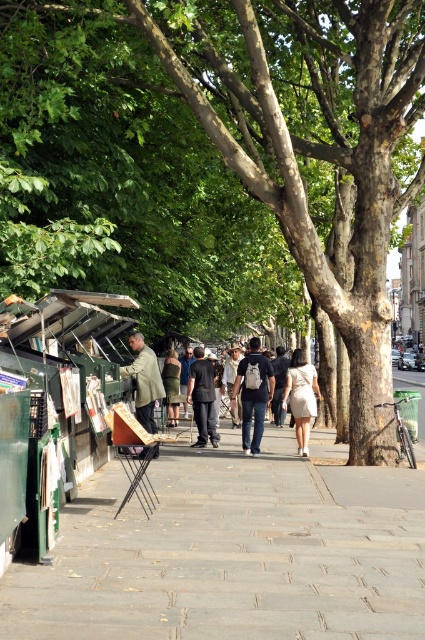
You are a delivery person standing at the brown rough tree at center. You need to deliver a package to the dark blue jeans at center. The delivery robot you use has a maximum range of 5 meters. Can the robot make the delivery without needing a recharge?

The distance between the brown rough tree at center and the dark blue jeans at center is 6.74 meters, which exceeds the robot s 5 meter range. Therefore, the robot cannot make the delivery without needing a recharge.

You are a delivery person needing to place a large box on the gray concrete pavement at center and the green matte jacket at left. Which surface can accommodate the box better based on their widths?

The gray concrete pavement at center has a greater width than the green matte jacket at left, so it can better accommodate the large box.